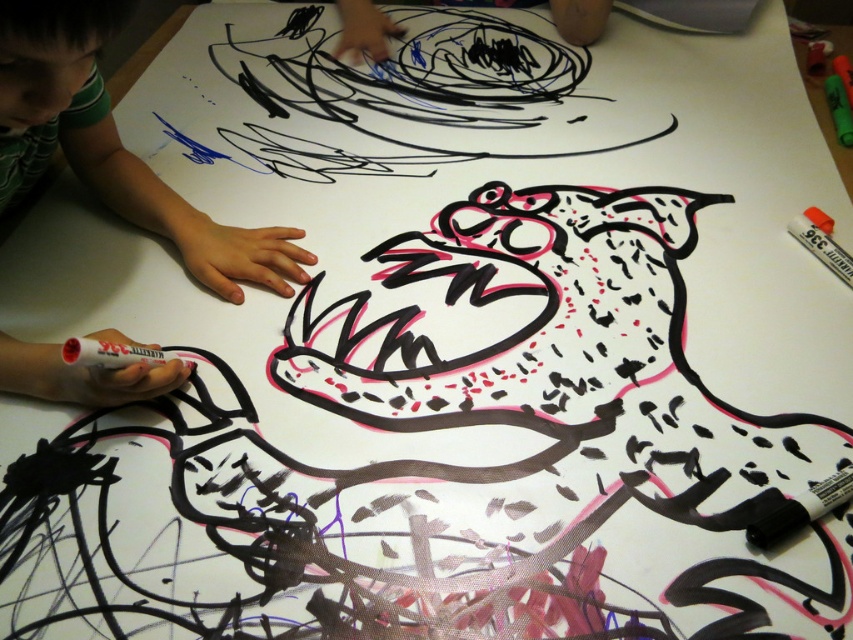
You are an art teacher observing a child drawing. You notice two markers on the paper. The white matte sharpie at lower left and the white matte marker at upper right. Which one is bigger?

The white matte sharpie at lower left is larger in size than the white matte marker at upper right.

Looking at this image, you are an art teacher observing a child drawing with the white matte sharpie at lower left and the white matte marker at upper right. Which tool has a thicker tip based on their line widths in the artwork?

The white matte sharpie at lower left might be wider than the white matte marker at upper right, so its lines are likely thicker.